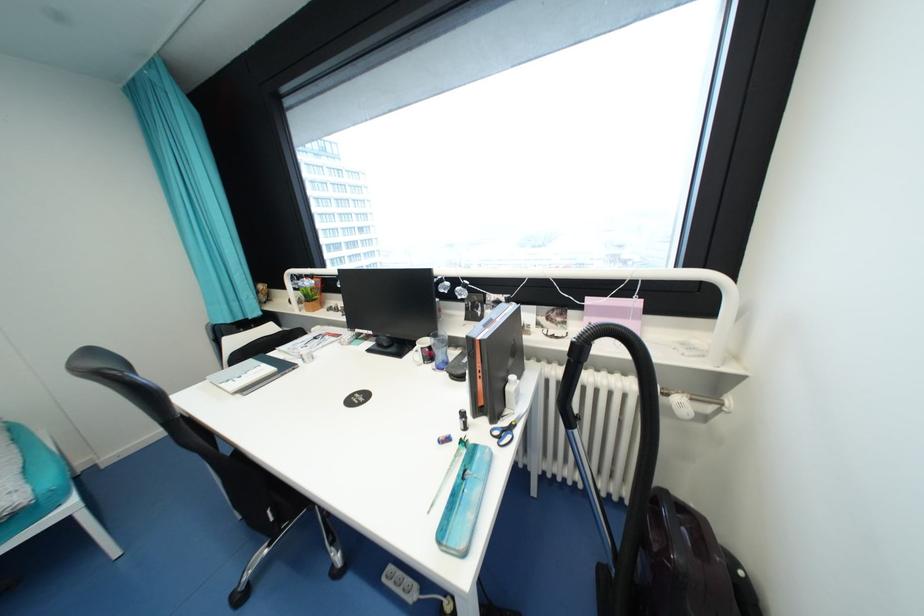
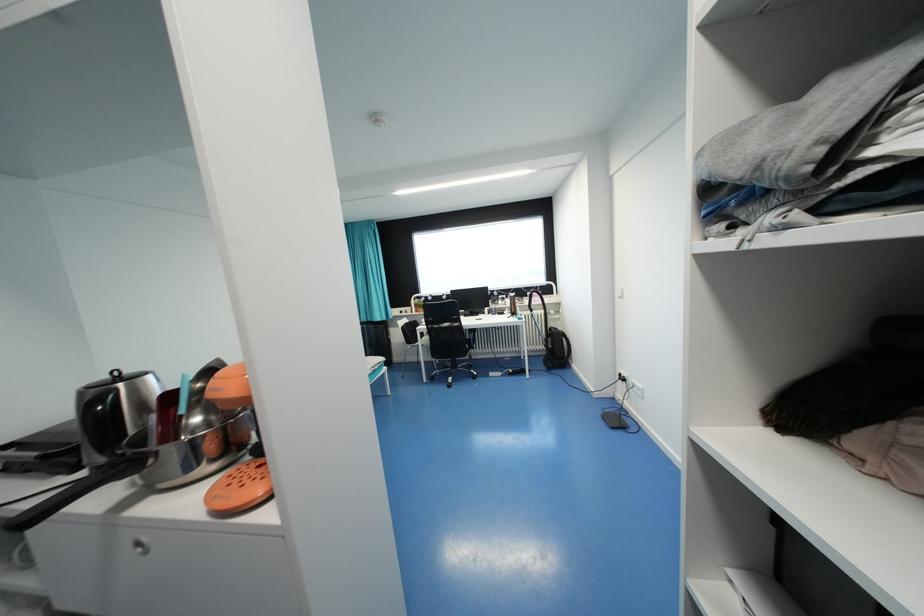
Which direction would the cameraman need to move to produce the second image?

Answer: The movement direction of the cameraman is left, backward.